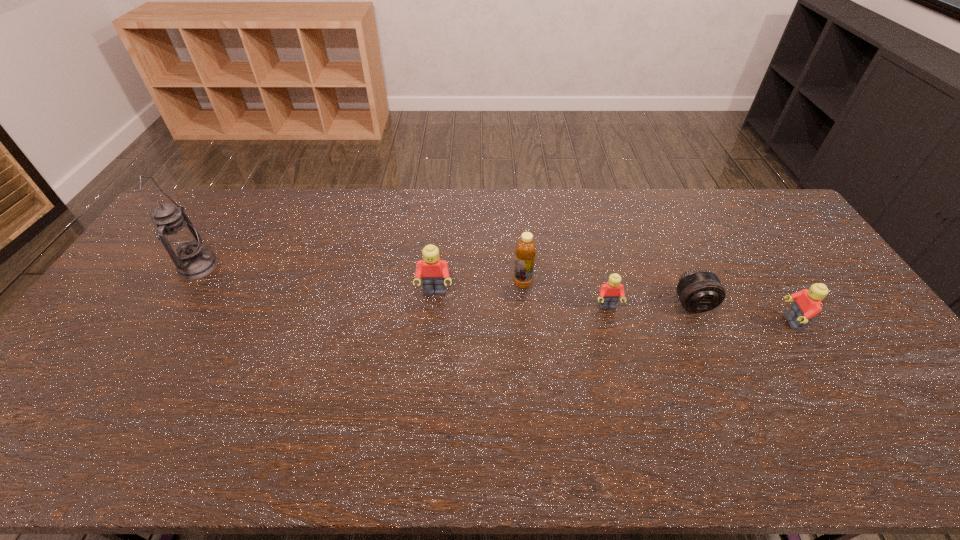
This screenshot has height=540, width=960. Find the location of `free space between the fourth object from left to right and the tallest object`. free space between the fourth object from left to right and the tallest object is located at coordinates (403, 287).

This screenshot has width=960, height=540. In order to click on unoccupied position between the leftmost object and the leftmost Lego in this screenshot , I will do `click(317, 280)`.

In order to click on vacant region between the leftmost object and the rightmost Lego in this screenshot , I will do `click(494, 294)`.

Locate an element on the screen. This screenshot has width=960, height=540. object that ranks as the fourth closest to the fourth object from right to left is located at coordinates [807, 304].

Identify the location of object that is the fifth nearest to the second shortest Lego. The image size is (960, 540). (181, 240).

Point out which Lego is positioned as the second nearest to the rightmost object. Please provide its 2D coordinates. Your answer should be formatted as a tuple, i.e. [(x, y)], where the tuple contains the x and y coordinates of a point satisfying the conditions above.

[(434, 272)]

Select which Lego appears as the closest to the tallest object. Please provide its 2D coordinates. Your answer should be formatted as a tuple, i.e. [(x, y)], where the tuple contains the x and y coordinates of a point satisfying the conditions above.

[(434, 272)]